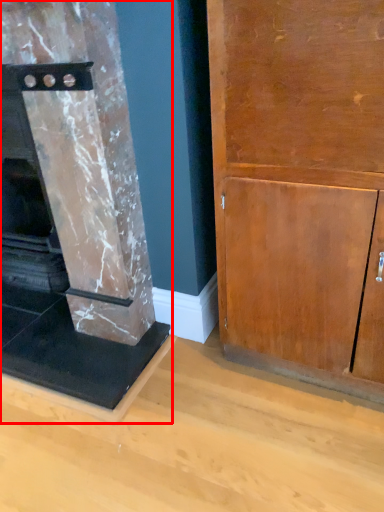
Question: Observing the image, what is the correct spatial positioning of fireplace (annotated by the red box) in reference to cupboard?

Choices:
 (A) right
 (B) left

Answer: (B)